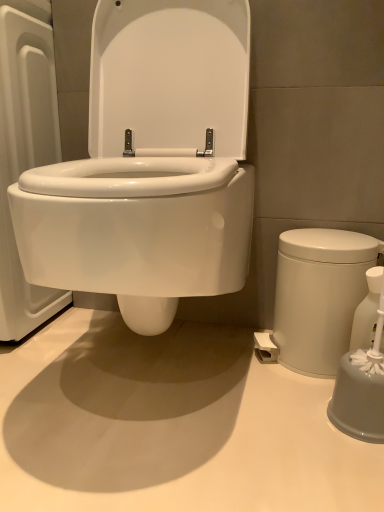
What are the coordinates of `white glossy trash can at right` in the screenshot? It's located at (319, 295).

Measure the distance between point (327, 242) and camera.

Point (327, 242) is 33.98 inches away from camera.

Describe the element at coordinates (319, 295) in the screenshot. I see `white glossy trash can at right` at that location.

Where is `white glossy soap dispenser at right`? white glossy soap dispenser at right is located at coordinates (367, 311).

Describe the element at coordinates (367, 311) in the screenshot. The height and width of the screenshot is (512, 384). I see `white glossy soap dispenser at right` at that location.

The width and height of the screenshot is (384, 512). Identify the location of white glossy trash can at right. (319, 295).

Which is more to the right, white glossy trash can at right or white glossy soap dispenser at right?

white glossy soap dispenser at right.

Is the position of white glossy trash can at right less distant than that of white glossy soap dispenser at right?

No.

Is point (366, 248) in front of point (381, 340)?

No, (366, 248) is further to viewer.

From the image's perspective, is white glossy trash can at right positioned above or below white glossy soap dispenser at right?

white glossy trash can at right is situated higher than white glossy soap dispenser at right in the image.

From a real-world perspective, between white glossy trash can at right and white glossy soap dispenser at right, who is vertically higher?

white glossy trash can at right, from a real-world perspective.

In terms of width, does white glossy trash can at right look wider or thinner when compared to white glossy soap dispenser at right?

white glossy trash can at right is wider than white glossy soap dispenser at right.

Is white glossy trash can at right taller or shorter than white glossy soap dispenser at right?

Considering their sizes, white glossy trash can at right has more height than white glossy soap dispenser at right.

Is white glossy trash can at right bigger than white glossy soap dispenser at right?

Yes.

Is white glossy soap dispenser at right completely or partially inside white glossy trash can at right?

Yes, white glossy soap dispenser at right can be found within white glossy trash can at right.

Is white glossy trash can at right not near white glossy soap dispenser at right?

No, white glossy trash can at right is not far away from white glossy soap dispenser at right.

Is white glossy trash can at right turned away from white glossy soap dispenser at right?

No, white glossy trash can at right is not facing away from white glossy soap dispenser at right.

I want to click on soap dispenser located underneath the white glossy trash can at right (from a real-world perspective), so click(x=367, y=311).

Can you confirm if white glossy soap dispenser at right is positioned to the left of white glossy trash can at right?

In fact, white glossy soap dispenser at right is to the right of white glossy trash can at right.

Based on the photo, which object is further away from the camera taking this photo, white glossy soap dispenser at right or white glossy trash can at right?

white glossy trash can at right is behind.

Considering the points (355, 340) and (320, 252), which point is in front, point (355, 340) or point (320, 252)?

The point (320, 252) is closer to the camera.

From the image's perspective, is white glossy soap dispenser at right located beneath white glossy trash can at right?

Yes, from the image's perspective, white glossy soap dispenser at right is beneath white glossy trash can at right.

From a real-world perspective, is white glossy soap dispenser at right physically below white glossy trash can at right?

Yes, from a real-world perspective, white glossy soap dispenser at right is beneath white glossy trash can at right.

Between white glossy soap dispenser at right and white glossy trash can at right, which one has larger width?

white glossy trash can at right.

Which of these two, white glossy soap dispenser at right or white glossy trash can at right, stands shorter?

With less height is white glossy soap dispenser at right.

Considering the sizes of objects white glossy soap dispenser at right and white glossy trash can at right in the image provided, who is smaller, white glossy soap dispenser at right or white glossy trash can at right?

white glossy soap dispenser at right.

Would you say white glossy soap dispenser at right is inside or outside white glossy trash can at right?

white glossy soap dispenser at right is spatially positioned inside white glossy trash can at right.

Would you say white glossy soap dispenser at right is a long distance from white glossy trash can at right?

Actually, white glossy soap dispenser at right and white glossy trash can at right are a little close together.

Could you tell me if white glossy soap dispenser at right is facing white glossy trash can at right?

Yes, white glossy soap dispenser at right is aimed at white glossy trash can at right.

Image resolution: width=384 pixels, height=512 pixels. I want to click on porcelain located behind the white glossy soap dispenser at right, so click(x=319, y=295).

Find the location of a particular element. The image size is (384, 512). soap dispenser in front of the white glossy trash can at right is located at coordinates (367, 311).

Identify the location of porcelain above the white glossy soap dispenser at right (from the image's perspective). (319, 295).